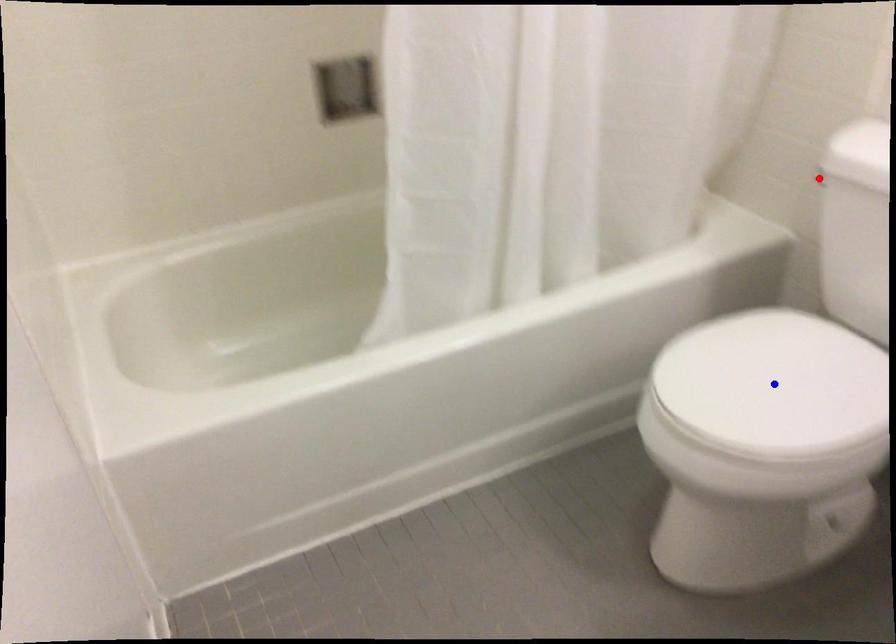
Question: Two points are marked on the image. Which point is closer to the camera?

Choices:
 (A) Blue point is closer.
 (B) Red point is closer.

Answer: (A)